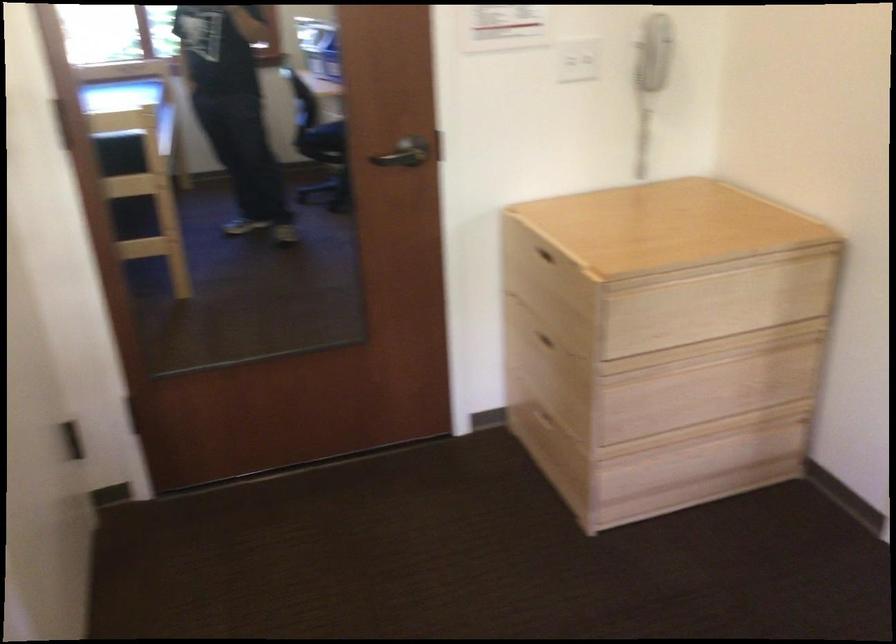
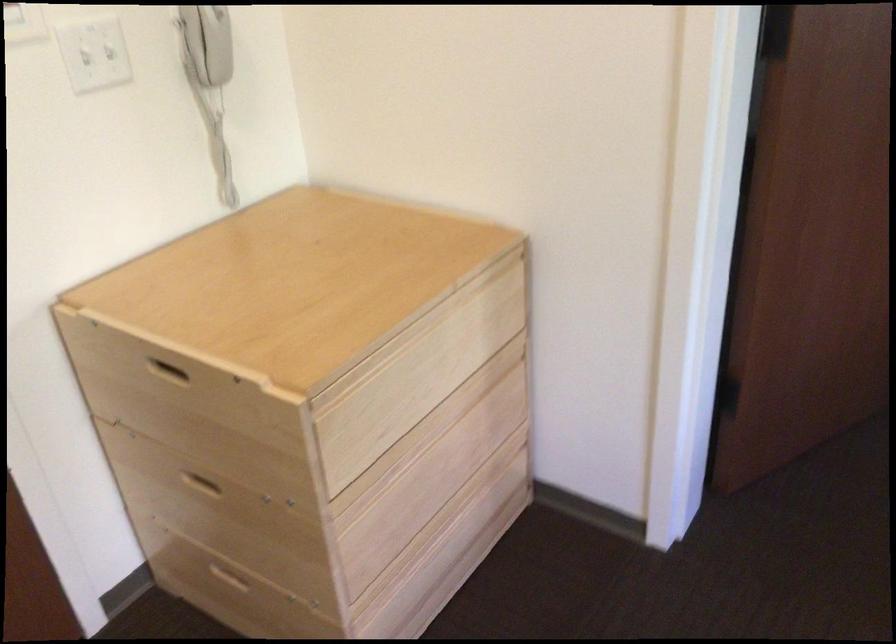
Question: The images are taken continuously from a first-person perspective. In which direction is your viewpoint rotating?

Choices:
 (A) Left
 (B) Right
 (C) Up
 (D) Down

Answer: (B)